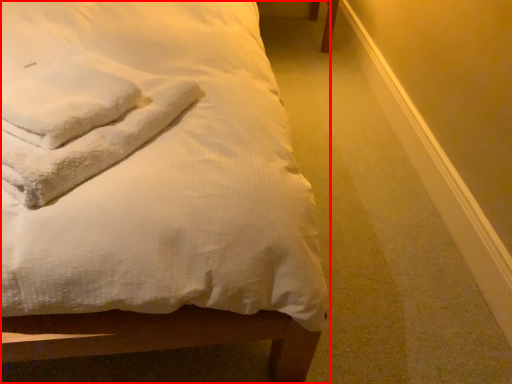
Question: From the image's perspective, what is the correct spatial positioning of bed (annotated by the red box) in reference to cloth?

Choices:
 (A) above
 (B) below

Answer: (A)